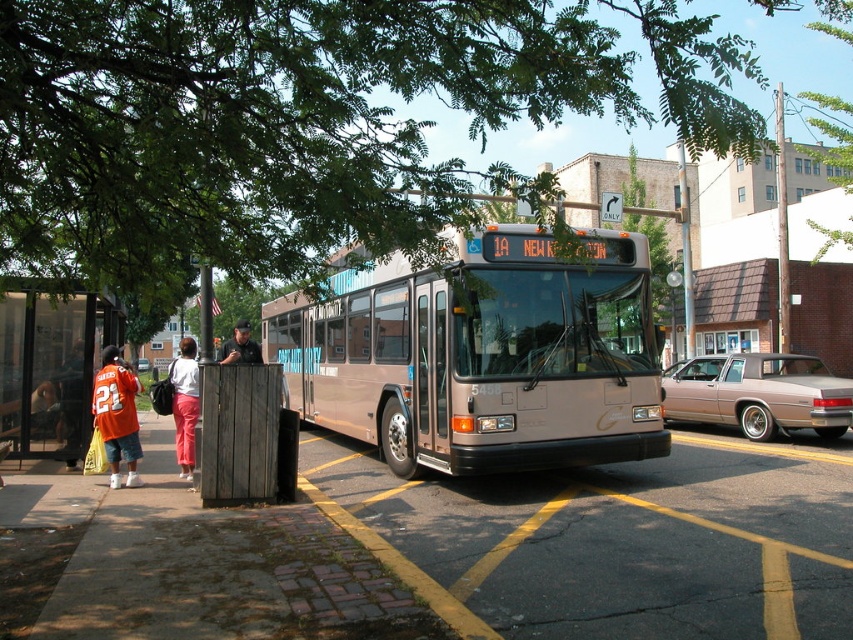
Question: Among these points, which one is nearest to the camera?

Choices:
 (A) (244, 352)
 (B) (105, 444)
 (C) (184, 445)
 (D) (102, 227)

Answer: (D)

Question: Is metallic gold bus at center to the right of orange jersey at lower left from the viewer's perspective?

Choices:
 (A) yes
 (B) no

Answer: (A)

Question: Which point appears farthest from the camera in this image?

Choices:
 (A) (140, 368)
 (B) (602, 611)
 (C) (178, 372)

Answer: (A)

Question: Is green leafy tree at upper left positioned in front of green leafy tree at upper center?

Choices:
 (A) no
 (B) yes

Answer: (B)

Question: Can you confirm if green leafy tree at upper left is wider than metallic gold bus at center?

Choices:
 (A) yes
 (B) no

Answer: (A)

Question: Which point appears farthest from the camera in this image?

Choices:
 (A) (242, 269)
 (B) (125, 378)
 (C) (198, 413)
 (D) (51, 339)

Answer: (D)